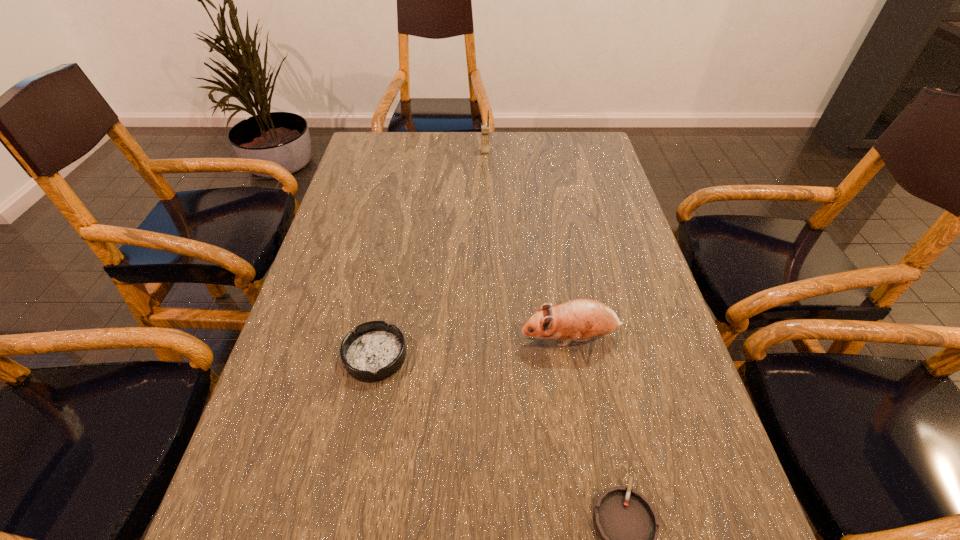
The width and height of the screenshot is (960, 540). In order to click on cellular telephone in this screenshot , I will do `click(484, 128)`.

You are a GUI agent. You are given a task and a screenshot of the screen. Output one action in this format:
    pyautogui.click(x=<x>, y=<y>)
    Task: Click on the farthest object
    The width and height of the screenshot is (960, 540).
    Given the screenshot: What is the action you would take?
    pyautogui.click(x=484, y=128)

Identify the location of the second tallest object. The height and width of the screenshot is (540, 960). (582, 319).

Where is `the leftmost object`? the leftmost object is located at coordinates (375, 350).

Where is `the left ashtray`? The image size is (960, 540). the left ashtray is located at coordinates (375, 350).

You are a GUI agent. You are given a task and a screenshot of the screen. Output one action in this format:
    pyautogui.click(x=<x>, y=<y>)
    Task: Click on the vacant space located 0.170m on the front of the second object from left to right, where the keypad is located
    This screenshot has height=540, width=960.
    Given the screenshot: What is the action you would take?
    pyautogui.click(x=486, y=185)

The image size is (960, 540). Find the location of `vacant region located 0.400m at the face of the third shortest object`. vacant region located 0.400m at the face of the third shortest object is located at coordinates (325, 339).

Locate an element on the screen. blank space located 0.290m at the face of the third shortest object is located at coordinates (379, 339).

What are the coordinates of `vacant space located 0.360m at the face of the third shortest object` in the screenshot? It's located at (345, 339).

Locate an element on the screen. blank space located 0.330m on the right of the third tallest object is located at coordinates (572, 356).